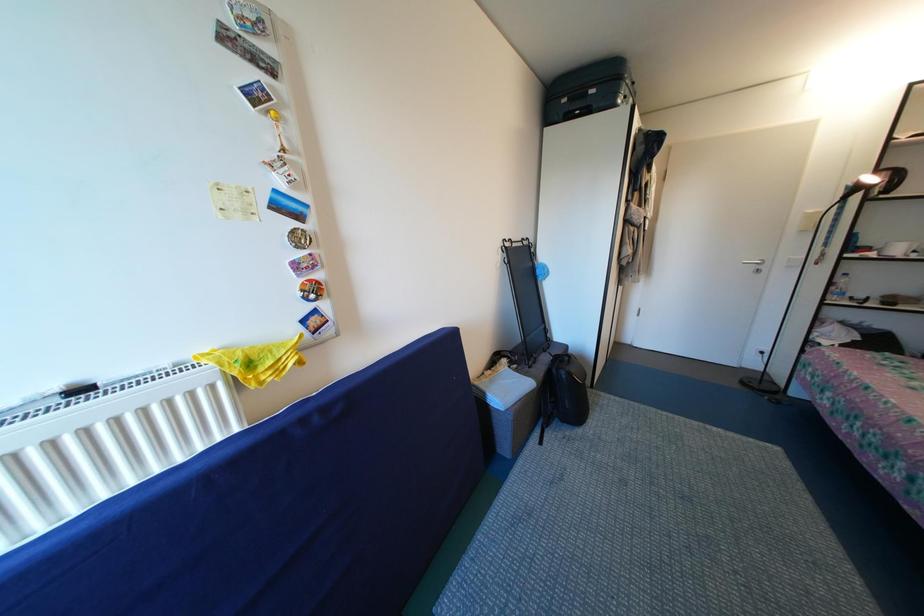
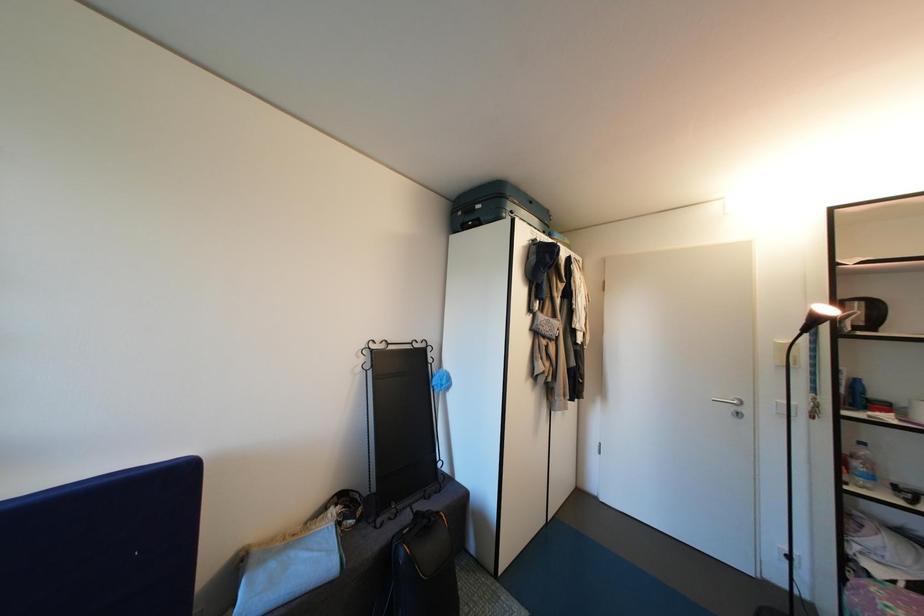
Question: Which direction would the cameraman need to move to produce the second image? Reply with the corresponding letter.

Choices:
 (A) Left
 (B) Right
 (C) Forward
 (D) Backward

Answer: (B)